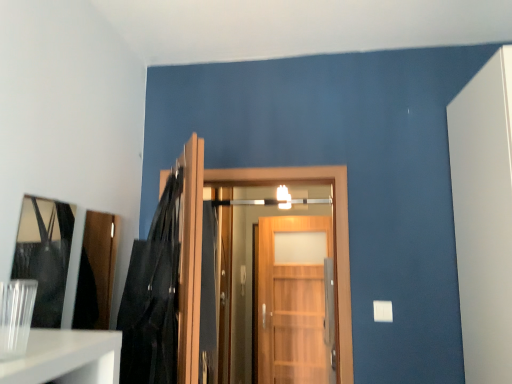
Question: From their relative heights in the image, would you say satin silver door handle at center is taller or shorter than wooden door at center, arranged as the 3th door when viewed from the back?

Choices:
 (A) tall
 (B) short

Answer: (B)

Question: In the image, is satin silver door handle at center on the left side or the right side of wooden door at center, arranged as the 3th door when viewed from the back?

Choices:
 (A) right
 (B) left

Answer: (A)

Question: Which of these objects is positioned closest to the matte black mirror at left?

Choices:
 (A) black leather jacket at upper left
 (B) satin silver door handle at center
 (C) wooden door at center, which is the 2th door from back to front
 (D) transparent glass vase at lower left
 (E) wooden door at center, the 1th door from the front

Answer: (A)

Question: Considering the real-world distances, which object is closest to the wooden door at center, placed as the 2th door when sorted from front to back?

Choices:
 (A) wooden door at center, the 1th door from the front
 (B) transparent glass vase at lower left
 (C) matte black mirror at left
 (D) wooden door at center, the first door viewed from the back
 (E) satin silver door handle at center

Answer: (C)